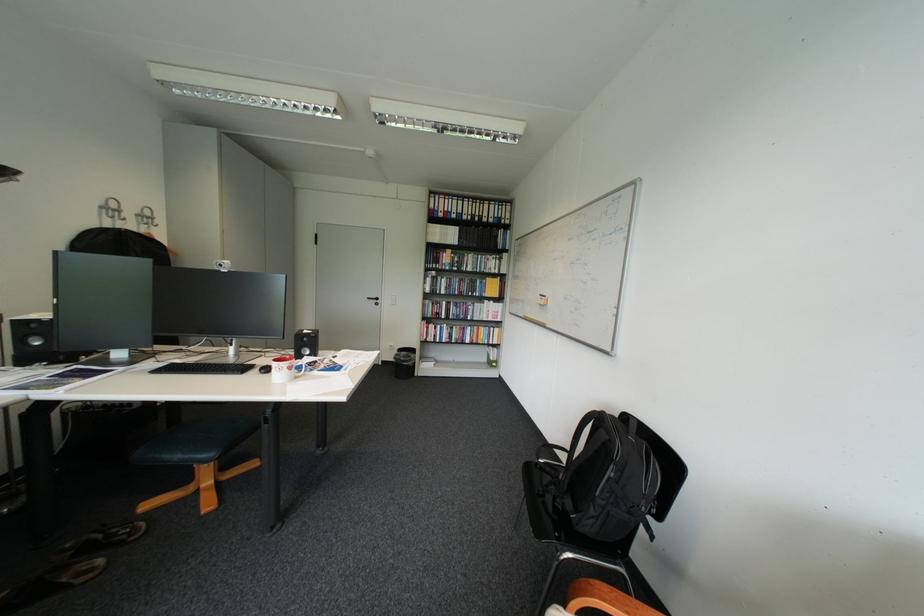
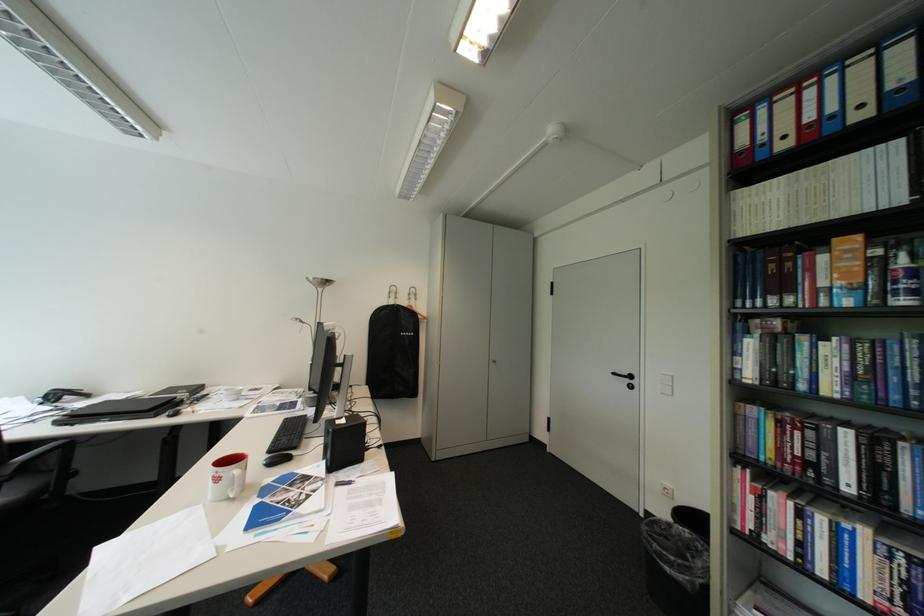
Locate, in the second image, the point that corresponds to (445,208) in the first image.

(760, 145)